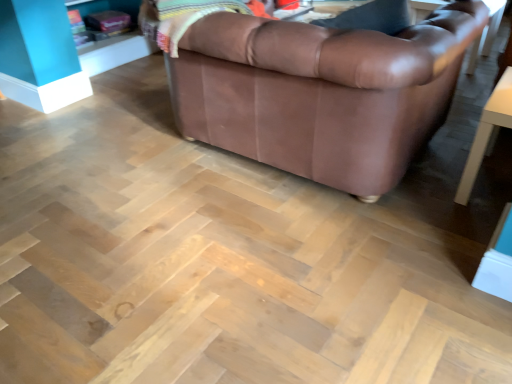
Question: In terms of height, does white glossy table at lower right look taller or shorter compared to brown leather couch at upper center?

Choices:
 (A) tall
 (B) short

Answer: (B)

Question: Is white glossy table at lower right situated inside brown leather couch at upper center or outside?

Choices:
 (A) outside
 (B) inside

Answer: (A)

Question: Is point (468, 193) positioned closer to the camera than point (287, 145)?

Choices:
 (A) farther
 (B) closer

Answer: (A)

Question: Is brown leather couch at upper center situated inside white glossy table at lower right or outside?

Choices:
 (A) inside
 (B) outside

Answer: (B)

Question: Is point (205, 117) positioned closer to the camera than point (501, 87)?

Choices:
 (A) farther
 (B) closer

Answer: (A)

Question: From the image's perspective, relative to white glossy table at lower right, is brown leather couch at upper center above or below?

Choices:
 (A) below
 (B) above

Answer: (B)

Question: From their relative heights in the image, would you say brown leather couch at upper center is taller or shorter than white glossy table at lower right?

Choices:
 (A) tall
 (B) short

Answer: (A)